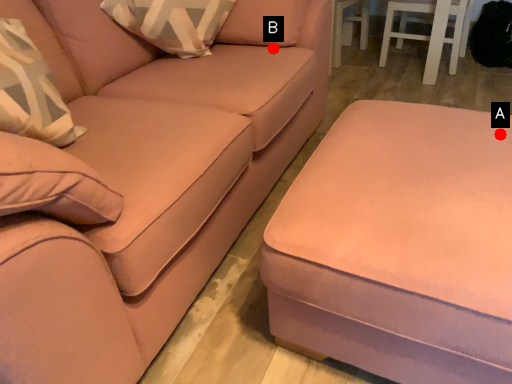
Question: Two points are circled on the image, labeled by A and B beside each circle. Which point is closer to the camera?

Choices:
 (A) A is closer
 (B) B is closer

Answer: (A)